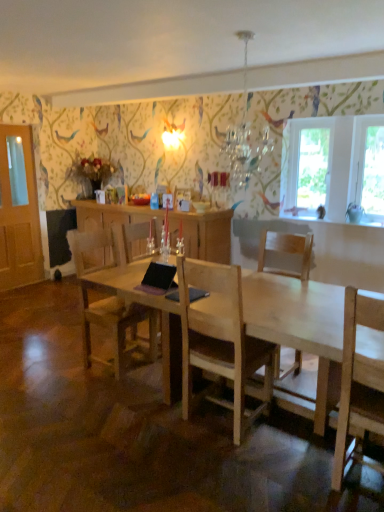
Question: In terms of height, does transparent glass window at right, the second window screen positioned from the left, look taller or shorter compared to crystal glass chandelier at upper center?

Choices:
 (A) tall
 (B) short

Answer: (A)

Question: Is transparent glass window at right, the first window screen from the right, in front of or behind crystal glass chandelier at upper center in the image?

Choices:
 (A) front
 (B) behind

Answer: (B)

Question: Based on their relative distances, which object is farther from the crystal glass chandelier at upper center?

Choices:
 (A) transparent glass window at right, the first window screen from the right
 (B) light brown wooden chair at center, the first chair viewed from the left
 (C) natural wood table at center
 (D) light wood chair at center, which ranks as the 2th chair in left-to-right order
 (E) wooden cabinet at center

Answer: (B)

Question: Which object is positioned farthest from the light wood chair at center, arranged as the 1th chair when viewed from the right?

Choices:
 (A) black matte laptop at center
 (B) natural wood table at center
 (C) light brown wooden chair at center, arranged as the second chair when viewed from the right
 (D) transparent glass window at upper right, the second window screen positioned from the right
 (E) transparent glass window at right, the second window screen positioned from the left

Answer: (C)